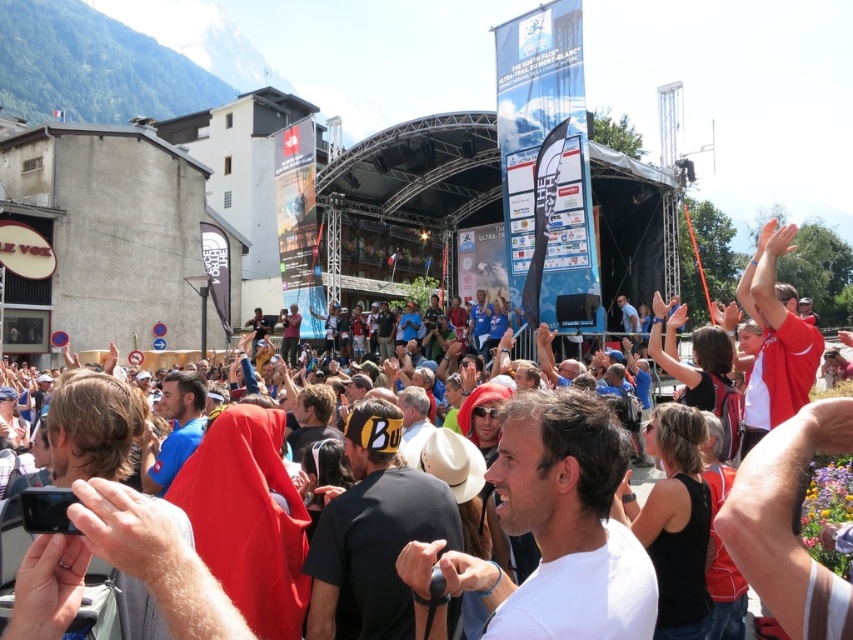
Question: Can you confirm if white matte shirt at center is positioned to the left of yellow fabric hat at center?

Choices:
 (A) no
 (B) yes

Answer: (A)

Question: Does yellow fabric hat at center appear under blue fabric shirt at center?

Choices:
 (A) yes
 (B) no

Answer: (A)

Question: Which of these objects is positioned farthest from the blue fabric shirt at center?

Choices:
 (A) yellow fabric hat at center
 (B) white matte shirt at center

Answer: (B)

Question: Can you confirm if white matte shirt at center is wider than yellow fabric hat at center?

Choices:
 (A) yes
 (B) no

Answer: (A)

Question: Considering the real-world distances, which object is closest to the yellow fabric hat at center?

Choices:
 (A) blue fabric shirt at center
 (B) white matte shirt at center

Answer: (B)

Question: Based on their relative distances, which object is farther from the white matte shirt at center?

Choices:
 (A) yellow fabric hat at center
 (B) blue fabric shirt at center

Answer: (B)